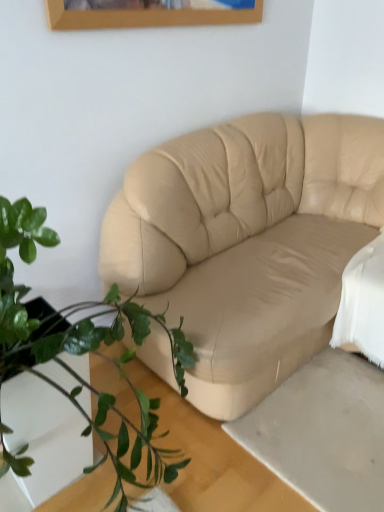
This screenshot has width=384, height=512. What are the coordinates of `green leafy plant at lower left` in the screenshot? It's located at (71, 357).

What do you see at coordinates (71, 357) in the screenshot? This screenshot has height=512, width=384. I see `green leafy plant at lower left` at bounding box center [71, 357].

What do you see at coordinates (247, 242) in the screenshot? Image resolution: width=384 pixels, height=512 pixels. I see `beige leather couch at center` at bounding box center [247, 242].

Image resolution: width=384 pixels, height=512 pixels. Find the location of `beige leather couch at center`. beige leather couch at center is located at coordinates (247, 242).

Locate an element on the screen. The width and height of the screenshot is (384, 512). green leafy plant at lower left is located at coordinates (71, 357).

Is beige leather couch at center at the right side of green leafy plant at lower left?

Correct, you'll find beige leather couch at center to the right of green leafy plant at lower left.

Is beige leather couch at center positioned in front of green leafy plant at lower left?

No, it is not.

Does point (319, 306) appear closer or farther from the camera than point (152, 472)?

Point (319, 306) is positioned farther from the camera compared to point (152, 472).

From the image's perspective, who appears lower, beige leather couch at center or green leafy plant at lower left?

From the image's view, green leafy plant at lower left is below.

From a real-world perspective, is beige leather couch at center physically below green leafy plant at lower left?

Yes, from a real-world perspective, beige leather couch at center is below green leafy plant at lower left.

Does beige leather couch at center have a lesser width compared to green leafy plant at lower left?

Incorrect, the width of beige leather couch at center is not less than that of green leafy plant at lower left.

Considering the sizes of objects beige leather couch at center and green leafy plant at lower left in the image provided, who is taller, beige leather couch at center or green leafy plant at lower left?

Standing taller between the two is green leafy plant at lower left.

Who is smaller, beige leather couch at center or green leafy plant at lower left?

green leafy plant at lower left is smaller.

Which is correct: beige leather couch at center is inside green leafy plant at lower left, or outside of it?

beige leather couch at center cannot be found inside green leafy plant at lower left.

Are beige leather couch at center and green leafy plant at lower left making contact?

No, beige leather couch at center is not next to green leafy plant at lower left.

Is beige leather couch at center facing towards green leafy plant at lower left?

Yes, beige leather couch at center is turned towards green leafy plant at lower left.

Identify the location of studio couch above the green leafy plant at lower left (from the image's perspective). (247, 242).

Which is more to the left, green leafy plant at lower left or beige leather couch at center?

Positioned to the left is green leafy plant at lower left.

Is green leafy plant at lower left positioned in front of beige leather couch at center?

That is True.

Considering the points (40, 208) and (137, 200), which point is behind, point (40, 208) or point (137, 200)?

The point (137, 200) is farther from the camera.

Looking at this image, from the image's perspective, relative to beige leather couch at center, is green leafy plant at lower left above or below?

Clearly, from the image's perspective, green leafy plant at lower left is below beige leather couch at center.

From a real-world perspective, is green leafy plant at lower left under beige leather couch at center?

Incorrect, from a real-world perspective, green leafy plant at lower left is higher than beige leather couch at center.

Considering the sizes of green leafy plant at lower left and beige leather couch at center in the image, is green leafy plant at lower left wider or thinner than beige leather couch at center?

Considering their sizes, green leafy plant at lower left looks slimmer than beige leather couch at center.

Is green leafy plant at lower left taller or shorter than beige leather couch at center?

Considering their sizes, green leafy plant at lower left has more height than beige leather couch at center.

Between green leafy plant at lower left and beige leather couch at center, which one has smaller size?

green leafy plant at lower left.

Is beige leather couch at center surrounded by green leafy plant at lower left?

No, beige leather couch at center is not a part of green leafy plant at lower left.

Is green leafy plant at lower left not near beige leather couch at center?

No, green leafy plant at lower left is not far away from beige leather couch at center.

Is green leafy plant at lower left aimed at beige leather couch at center?

No, green leafy plant at lower left is not facing towards beige leather couch at center.

What's the angular difference between green leafy plant at lower left and beige leather couch at center's facing directions?

The angle between the facing direction of green leafy plant at lower left and the facing direction of beige leather couch at center is 90.3 degrees.

Looking at this image, measure the distance from green leafy plant at lower left to beige leather couch at center.

20.73 inches.

Where is `studio couch above the green leafy plant at lower left (from the image's perspective)`? This screenshot has height=512, width=384. studio couch above the green leafy plant at lower left (from the image's perspective) is located at coordinates (247, 242).

This screenshot has width=384, height=512. I want to click on studio couch on the right side of green leafy plant at lower left, so click(x=247, y=242).

Locate an element on the screen. Image resolution: width=384 pixels, height=512 pixels. houseplant in front of the beige leather couch at center is located at coordinates (71, 357).